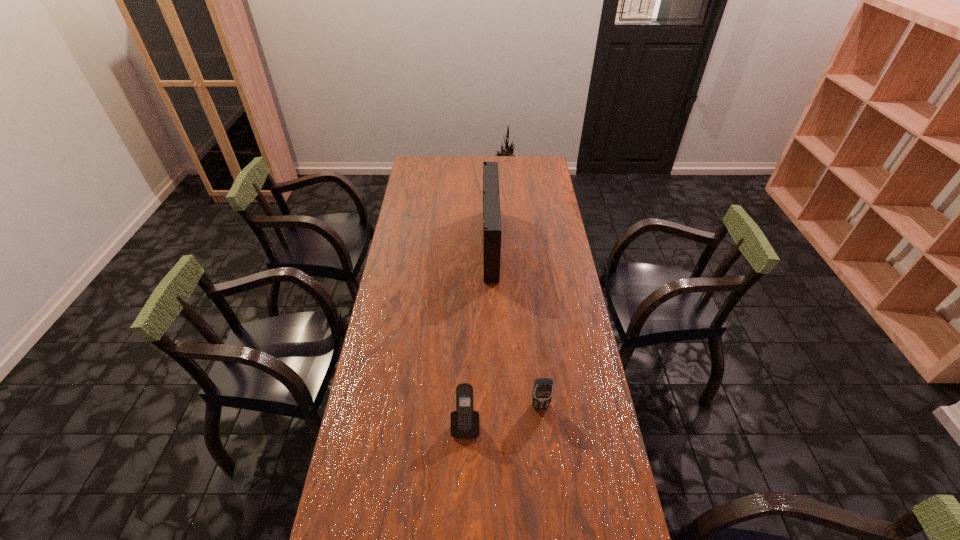
Locate an element on the screen. The height and width of the screenshot is (540, 960). free area in between the second nearest object and the tallest object is located at coordinates click(x=516, y=325).

Locate an element on the screen. The width and height of the screenshot is (960, 540). vacant area between the right cellular telephone and the nearer cellular telephone is located at coordinates 503,415.

This screenshot has width=960, height=540. Find the location of `free point between the farther cellular telephone and the nearest object`. free point between the farther cellular telephone and the nearest object is located at coordinates (503, 415).

Locate an element on the screen. unoccupied position between the farthest object and the right cellular telephone is located at coordinates (516, 325).

At what (x,y) coordinates should I click in order to perform the action: click on vacant area between the second nearest object and the tallest object. Please return your answer as a coordinate pair (x, y). The width and height of the screenshot is (960, 540). Looking at the image, I should click on 516,325.

Find the location of `object that stands as the closest to the second object from left to right`. object that stands as the closest to the second object from left to right is located at coordinates (542, 393).

Point out which object is positioned as the second nearest to the tallest object. Please provide its 2D coordinates. Your answer should be formatted as a tuple, i.e. [(x, y)], where the tuple contains the x and y coordinates of a point satisfying the conditions above.

[(464, 421)]

Locate an element on the screen. This screenshot has width=960, height=540. free spot that satisfies the following two spatial constraints: 1. on the side of the videotape with visible spindles; 2. on the front-facing side of the nearer cellular telephone is located at coordinates coord(495,425).

Find the location of a particular element. This screenshot has height=540, width=960. free location that satisfies the following two spatial constraints: 1. on the side of the farthest object with visible spindles; 2. on the front-facing side of the leftmost object is located at coordinates (495, 425).

Where is `free space that satisfies the following two spatial constraints: 1. on the side of the second object from left to right with visible spindles; 2. on the front-facing side of the nearest object`? This screenshot has height=540, width=960. free space that satisfies the following two spatial constraints: 1. on the side of the second object from left to right with visible spindles; 2. on the front-facing side of the nearest object is located at coordinates (495, 425).